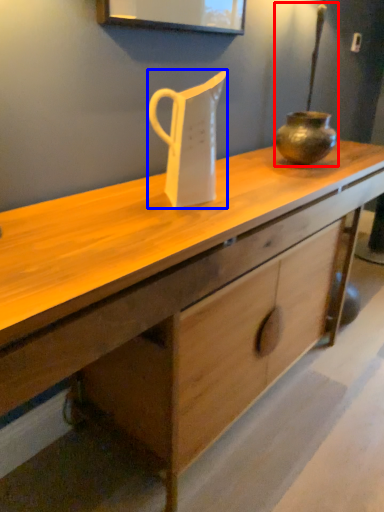
Question: Which object appears farthest to the camera in this image, candle holder (highlighted by a red box) or jug (highlighted by a blue box)?

Choices:
 (A) candle holder
 (B) jug

Answer: (A)